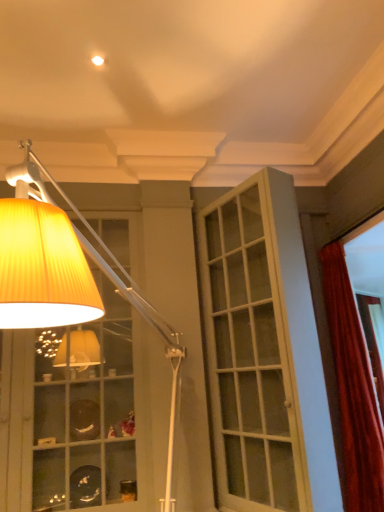
Question: Is yellow pleated lampshade at upper left bigger than white glass door at center?

Choices:
 (A) yes
 (B) no

Answer: (A)

Question: Is the depth of yellow pleated lampshade at upper left greater than that of white glass door at center?

Choices:
 (A) yes
 (B) no

Answer: (B)

Question: Is yellow pleated lampshade at upper left positioned far away from white glass door at center?

Choices:
 (A) yes
 (B) no

Answer: (B)

Question: Is yellow pleated lampshade at upper left oriented away from white glass door at center?

Choices:
 (A) yes
 (B) no

Answer: (B)

Question: Does yellow pleated lampshade at upper left appear on the right side of white glass door at center?

Choices:
 (A) yes
 (B) no

Answer: (B)

Question: Visually, is white glass door at center positioned to the left or to the right of velvet red curtain at right?

Choices:
 (A) right
 (B) left

Answer: (B)

Question: Is white glass door at center inside or outside of velvet red curtain at right?

Choices:
 (A) inside
 (B) outside

Answer: (B)

Question: In terms of width, does white glass door at center look wider or thinner when compared to velvet red curtain at right?

Choices:
 (A) thin
 (B) wide

Answer: (A)

Question: From a real-world perspective, is white glass door at center physically located above or below velvet red curtain at right?

Choices:
 (A) below
 (B) above

Answer: (B)

Question: Is yellow pleated lampshade at upper left wider or thinner than velvet red curtain at right?

Choices:
 (A) thin
 (B) wide

Answer: (B)

Question: Considering the positions of yellow pleated lampshade at upper left and velvet red curtain at right in the image, is yellow pleated lampshade at upper left taller or shorter than velvet red curtain at right?

Choices:
 (A) short
 (B) tall

Answer: (A)

Question: Considering the relative positions of yellow pleated lampshade at upper left and velvet red curtain at right in the image provided, is yellow pleated lampshade at upper left to the left or to the right of velvet red curtain at right?

Choices:
 (A) right
 (B) left

Answer: (B)

Question: From a real-world perspective, is yellow pleated lampshade at upper left physically located above or below velvet red curtain at right?

Choices:
 (A) below
 (B) above

Answer: (B)

Question: From a real-world perspective, relative to yellow pleated lampshade at upper left, is white glass door at center vertically above or below?

Choices:
 (A) below
 (B) above

Answer: (B)

Question: Considering the relative positions of white glass door at center and yellow pleated lampshade at upper left in the image provided, is white glass door at center to the left or to the right of yellow pleated lampshade at upper left?

Choices:
 (A) right
 (B) left

Answer: (A)